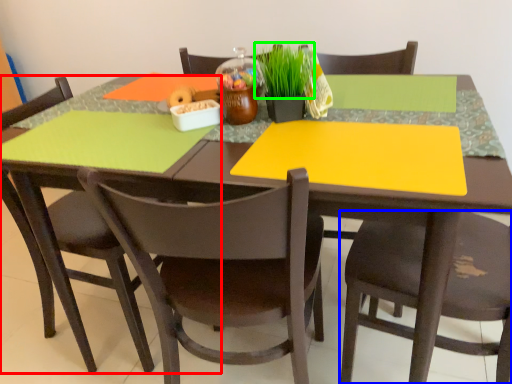
Question: Based on their relative distances, which object is farther from chair (highlighted by a red box)? Choose from chair (highlighted by a blue box) and plant (highlighted by a green box).

Choices:
 (A) chair
 (B) plant

Answer: (A)